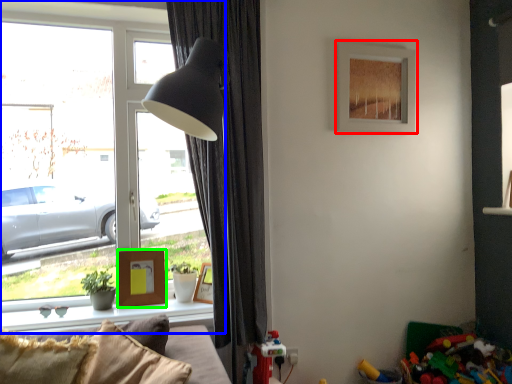
Question: Based on their relative distances, which object is nearer to picture frame (highlighted by a red box)? Choose from window (highlighted by a blue box) and picture frame (highlighted by a green box).

Choices:
 (A) window
 (B) picture frame

Answer: (A)